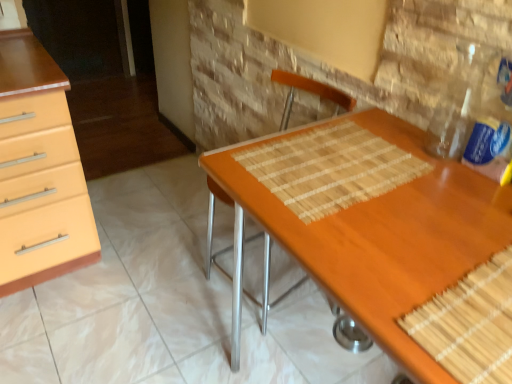
Question: Is clear plastic bottle at upper right completely or partially outside of bamboo placemat at center?

Choices:
 (A) no
 (B) yes

Answer: (B)

Question: Does clear plastic bottle at upper right turn towards bamboo placemat at center?

Choices:
 (A) no
 (B) yes

Answer: (A)

Question: Can you confirm if clear plastic bottle at upper right is smaller than bamboo placemat at center?

Choices:
 (A) yes
 (B) no

Answer: (B)

Question: Considering the relative sizes of clear plastic bottle at upper right and bamboo placemat at center in the image provided, is clear plastic bottle at upper right bigger than bamboo placemat at center?

Choices:
 (A) no
 (B) yes

Answer: (B)

Question: From a real-world perspective, does clear plastic bottle at upper right stand above bamboo placemat at center?

Choices:
 (A) no
 (B) yes

Answer: (B)

Question: Is clear plastic bottle at upper right surrounding bamboo placemat at center?

Choices:
 (A) no
 (B) yes

Answer: (A)

Question: Is wooden desk at center beside clear plastic bottle at upper right?

Choices:
 (A) yes
 (B) no

Answer: (B)

Question: Is wooden desk at center thinner than clear plastic bottle at upper right?

Choices:
 (A) no
 (B) yes

Answer: (A)

Question: Does wooden desk at center have a lesser height compared to clear plastic bottle at upper right?

Choices:
 (A) yes
 (B) no

Answer: (B)

Question: From a real-world perspective, is wooden desk at center over clear plastic bottle at upper right?

Choices:
 (A) yes
 (B) no

Answer: (B)

Question: Can you confirm if wooden desk at center is taller than clear plastic bottle at upper right?

Choices:
 (A) no
 (B) yes

Answer: (B)

Question: Can you confirm if wooden desk at center is smaller than clear plastic bottle at upper right?

Choices:
 (A) yes
 (B) no

Answer: (B)

Question: From a real-world perspective, does bamboo placemat at center sit lower than clear plastic bottle at upper right?

Choices:
 (A) yes
 (B) no

Answer: (A)